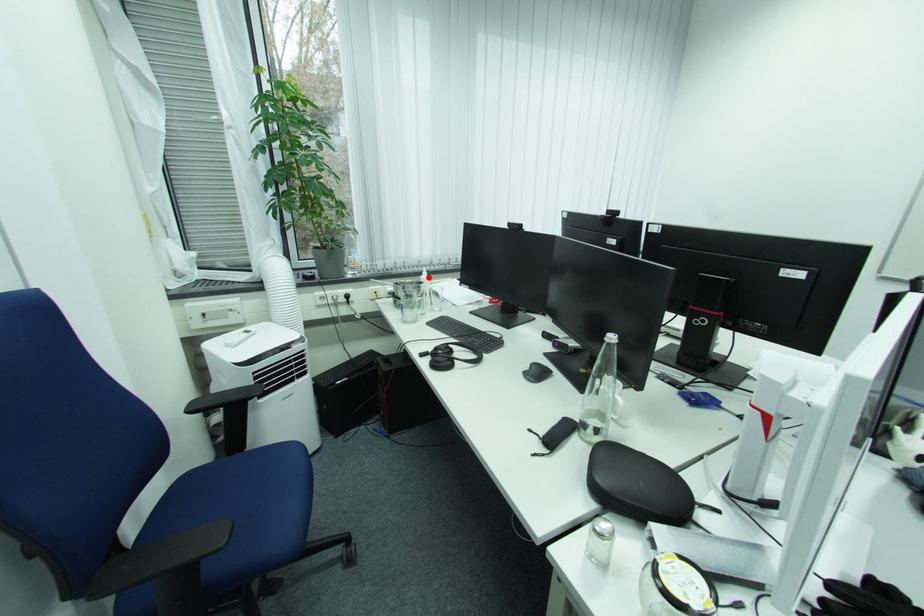
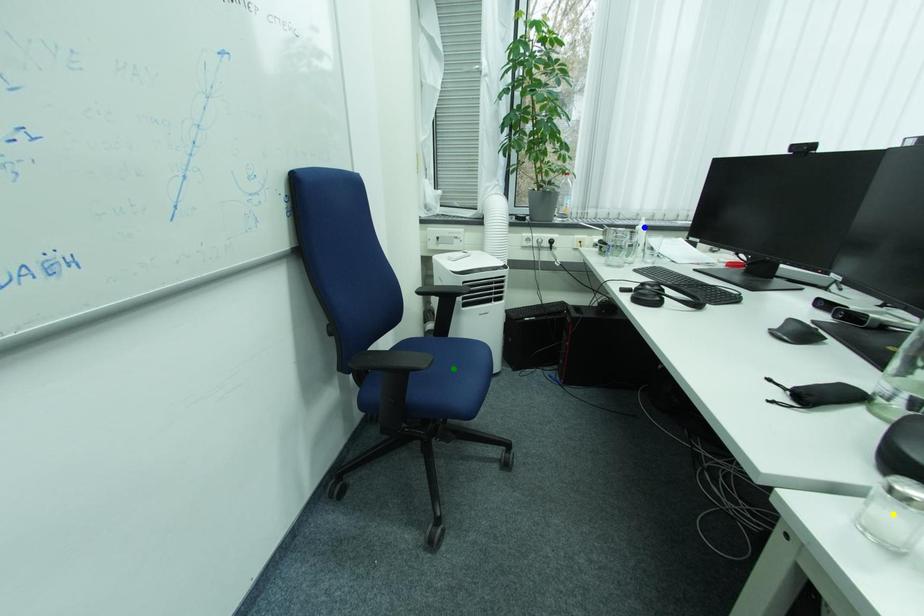
Question: I am providing you with two images of the same scene from different viewpoints. A red point is marked on the first image. You are given multiple points on the second image. Which spot in image 2 lines up with the point in image 1?

Choices:
 (A) blue point
 (B) green point
 (C) yellow point

Answer: (A)